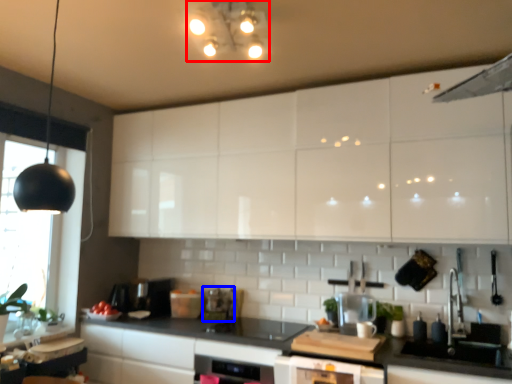
Question: Which point is further to the camera, light fixture (highlighted by a red box) or appliance (highlighted by a blue box)?

Choices:
 (A) light fixture
 (B) appliance

Answer: (B)